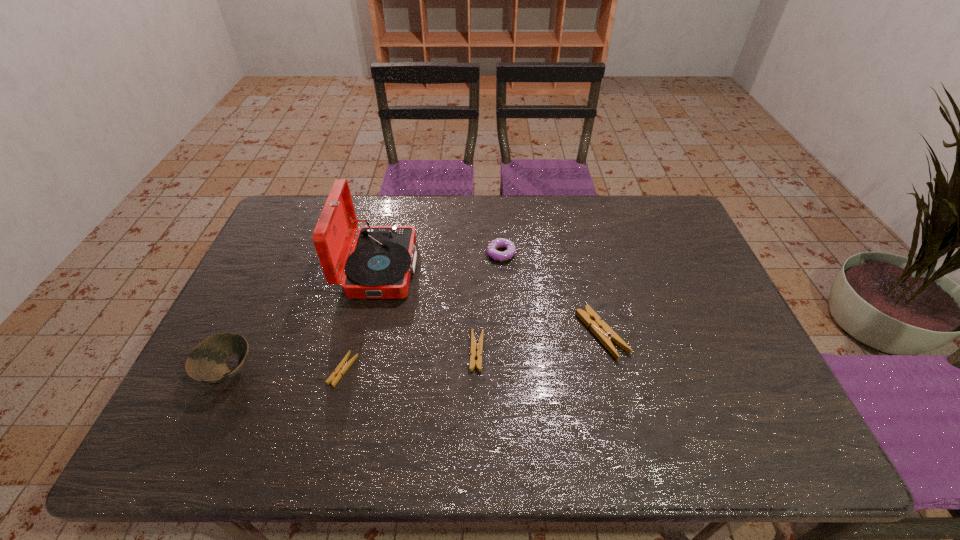
Where is `object at the near left corner`? The image size is (960, 540). object at the near left corner is located at coordinates [x=206, y=363].

This screenshot has width=960, height=540. What are the coordinates of `vacant area at the far edge` in the screenshot? It's located at (559, 203).

Locate an element on the screen. free spot at the near edge of the desktop is located at coordinates (522, 389).

Locate an element on the screen. This screenshot has height=540, width=960. vacant area at the left edge is located at coordinates (254, 372).

Locate an element on the screen. This screenshot has width=960, height=540. blank space at the right edge of the desktop is located at coordinates (710, 333).

Find the location of a particular element. The width and height of the screenshot is (960, 540). vacant space at the far left corner of the desktop is located at coordinates (291, 220).

I want to click on vacant space at the near left corner of the desktop, so point(231,403).

Locate an element on the screen. The width and height of the screenshot is (960, 540). vacant space at the near right corner of the desktop is located at coordinates (715, 379).

The image size is (960, 540). What are the coordinates of `vacant area that lies between the second tallest object and the tallest object` in the screenshot? It's located at (303, 320).

Locate an element on the screen. The height and width of the screenshot is (540, 960). free space between the bowl and the second object from right to left is located at coordinates (365, 313).